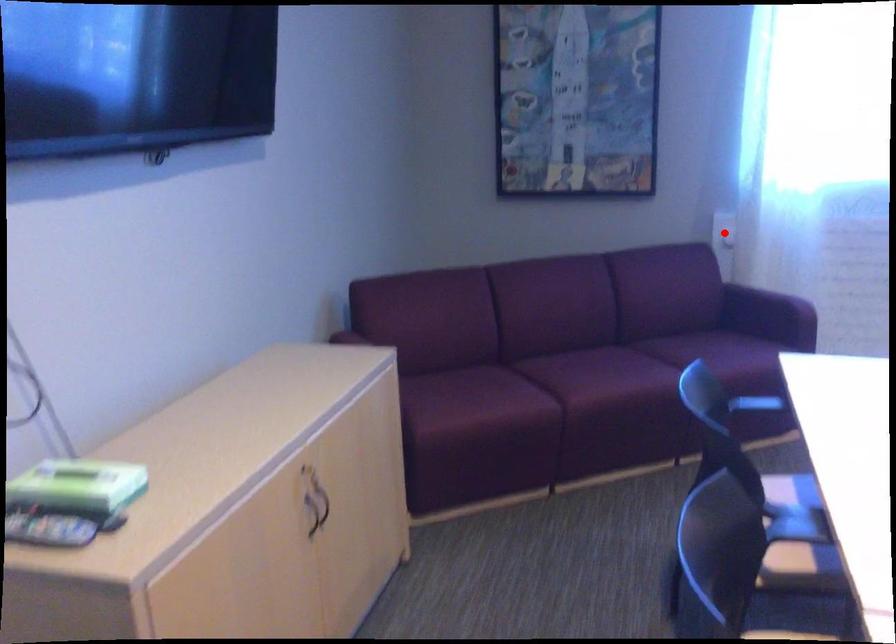
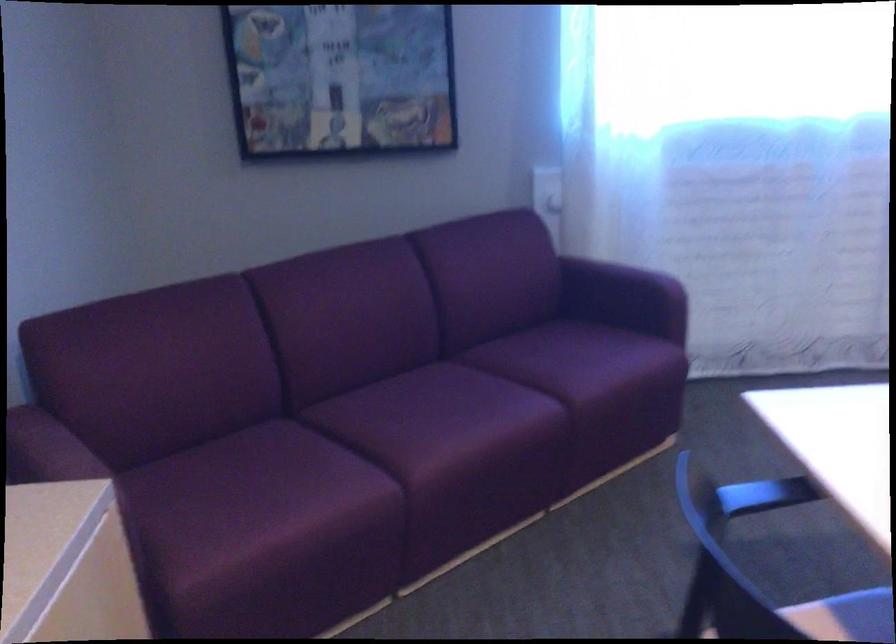
The point at the highlighted location is marked in the first image. Where is the corresponding point in the second image?

(547, 191)